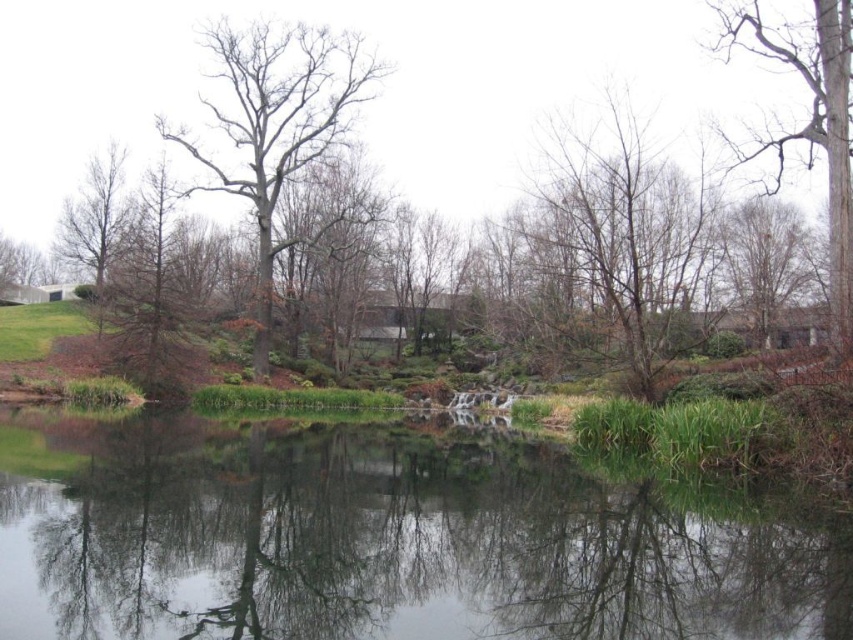
Can you confirm if brown textured tree at upper right is positioned to the left of bare wood tree at left?

No, brown textured tree at upper right is not to the left of bare wood tree at left.

What are the coordinates of `brown textured tree at upper right` in the screenshot? It's located at (767, 268).

This screenshot has width=853, height=640. What do you see at coordinates (767, 268) in the screenshot?
I see `brown textured tree at upper right` at bounding box center [767, 268].

At what (x,y) coordinates should I click in order to perform the action: click on brown textured tree at upper right. Please return your answer as a coordinate pair (x, y). The width and height of the screenshot is (853, 640). Looking at the image, I should click on (767, 268).

Does bare branches at center appear over brown matte tree at upper left?

Actually, bare branches at center is below brown matte tree at upper left.

Can you confirm if bare branches at center is wider than brown matte tree at upper left?

No, bare branches at center is not wider than brown matte tree at upper left.

The height and width of the screenshot is (640, 853). What do you see at coordinates (624, 237) in the screenshot? I see `bare branches at center` at bounding box center [624, 237].

Locate an element on the screen. The width and height of the screenshot is (853, 640). bare branches at center is located at coordinates (624, 237).

Is bare wood tree at center positioned behind bare wood tree at left?

Yes, it is.

Does bare wood tree at center have a lesser width compared to bare wood tree at left?

Correct, bare wood tree at center's width is less than bare wood tree at left's.

Is point (291, 122) positioned in front of point (74, 221)?

Yes, it is.

Locate an element on the screen. bare wood tree at center is located at coordinates (276, 124).